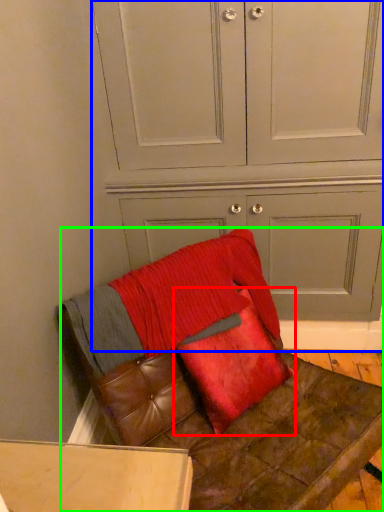
Question: Which object is positioned closest to pillow (highlighted by a red box)? Select from dresser (highlighted by a blue box) and furniture (highlighted by a green box).

Choices:
 (A) dresser
 (B) furniture

Answer: (B)